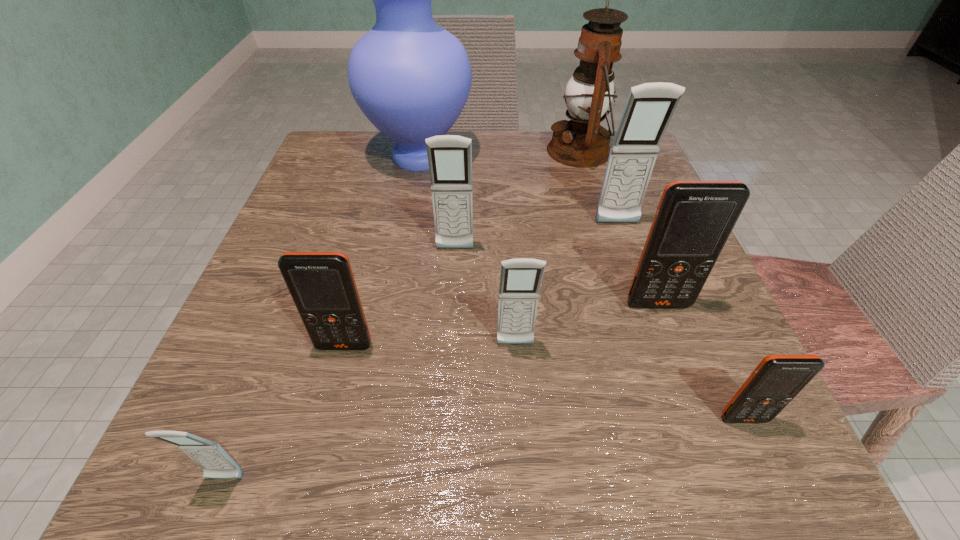
Find the location of a particular element. object that is at the far left corner is located at coordinates (411, 78).

Locate an element on the screen. The width and height of the screenshot is (960, 540). object situated at the near left corner is located at coordinates (216, 463).

In order to click on object at the far right corner in this screenshot , I will do `click(582, 142)`.

Locate an element on the screen. The image size is (960, 540). object present at the near right corner is located at coordinates (777, 379).

Identify the location of vacant space at the far edge of the desktop. This screenshot has width=960, height=540. pyautogui.click(x=538, y=145).

The height and width of the screenshot is (540, 960). Find the location of `vacant space at the near edge of the desktop`. vacant space at the near edge of the desktop is located at coordinates (647, 478).

Image resolution: width=960 pixels, height=540 pixels. In the image, there is a desktop. Identify the location of vacant space at the left edge. (333, 209).

Locate an element on the screen. The width and height of the screenshot is (960, 540). vacant region at the right edge of the desktop is located at coordinates (704, 298).

Locate an element on the screen. This screenshot has width=960, height=540. vacant space at the far left corner of the desktop is located at coordinates (374, 141).

In the image, there is a desktop. Identify the location of vacant space at the near right corner. (656, 454).